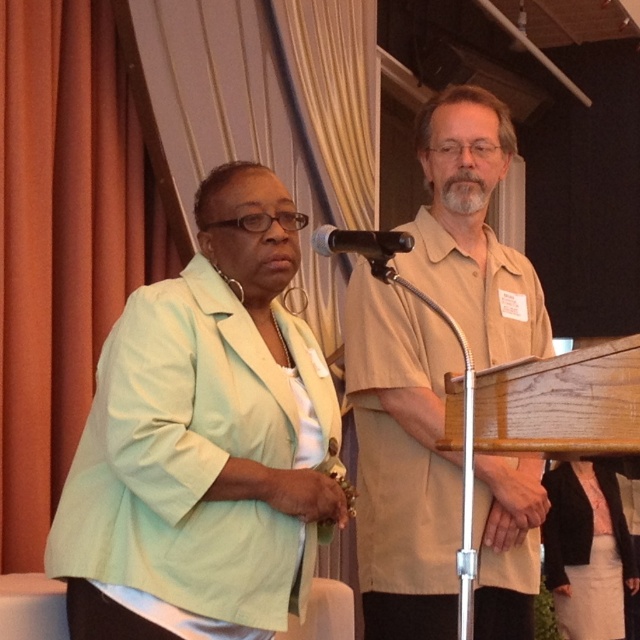
Question: Does light green fabric jacket at left appear on the right side of black plastic microphone at upper center?

Choices:
 (A) yes
 (B) no

Answer: (B)

Question: Estimate the real-world distances between objects in this image. Which object is farther from the light green fabric jacket at left?

Choices:
 (A) black plastic microphone at upper center
 (B) beige shirt at center

Answer: (B)

Question: Which point appears closest to the camera in this image?

Choices:
 (A) (392, 374)
 (B) (412, 236)

Answer: (B)

Question: Is light green fabric jacket at left thinner than black plastic microphone at upper center?

Choices:
 (A) yes
 (B) no

Answer: (B)

Question: Which point is closer to the camera?

Choices:
 (A) (440, 349)
 (B) (253, 209)
 (C) (408, 237)

Answer: (C)

Question: Can you confirm if light green fabric jacket at left is positioned below beige shirt at center?

Choices:
 (A) no
 (B) yes

Answer: (B)